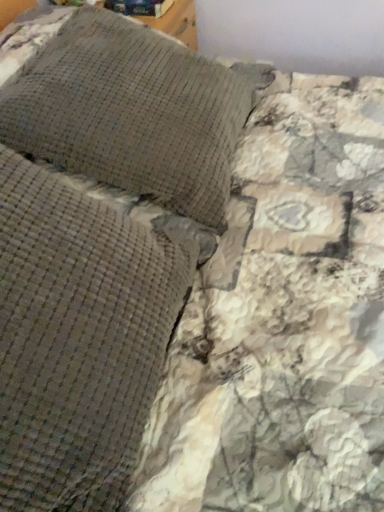
The height and width of the screenshot is (512, 384). What do you see at coordinates (78, 338) in the screenshot?
I see `woven fabric pillow at upper left, which ranks as the first pillow in front-to-back order` at bounding box center [78, 338].

Locate an element on the screen. This screenshot has width=384, height=512. woven fabric pillow at upper left, positioned as the 2th pillow in back-to-front order is located at coordinates (78, 338).

What are the coordinates of `woven fabric pillow at upper left, acting as the first pillow starting from the back` in the screenshot? It's located at (131, 113).

Image resolution: width=384 pixels, height=512 pixels. What do you see at coordinates (131, 113) in the screenshot? I see `woven fabric pillow at upper left, the second pillow when ordered from front to back` at bounding box center [131, 113].

You are a GUI agent. You are given a task and a screenshot of the screen. Output one action in this format:
    pyautogui.click(x=<x>, y=<y>)
    Task: Click on the woven fabric pillow at upper left, which ranks as the first pillow in front-to-back order
    
    Given the screenshot: What is the action you would take?
    pyautogui.click(x=78, y=338)

Is woven fabric pillow at upper left, positioned as the 2th pillow in back-to-front order, at the left side of woven fabric pillow at upper left, the second pillow when ordered from front to back?

Correct, you'll find woven fabric pillow at upper left, positioned as the 2th pillow in back-to-front order, to the left of woven fabric pillow at upper left, the second pillow when ordered from front to back.

Which object is further away from the camera, woven fabric pillow at upper left, positioned as the 2th pillow in back-to-front order, or woven fabric pillow at upper left, acting as the first pillow starting from the back?

Positioned behind is woven fabric pillow at upper left, acting as the first pillow starting from the back.

Which is in front, point (132, 403) or point (102, 120)?

The point (132, 403) is closer to the camera.

From the image's perspective, which is below, woven fabric pillow at upper left, positioned as the 2th pillow in back-to-front order, or woven fabric pillow at upper left, acting as the first pillow starting from the back?

woven fabric pillow at upper left, positioned as the 2th pillow in back-to-front order, from the image's perspective.

From a real-world perspective, does woven fabric pillow at upper left, positioned as the 2th pillow in back-to-front order, stand above woven fabric pillow at upper left, the second pillow when ordered from front to back?

Yes, from a real-world perspective, woven fabric pillow at upper left, positioned as the 2th pillow in back-to-front order, is above woven fabric pillow at upper left, the second pillow when ordered from front to back.

Based on the photo, which of these two, woven fabric pillow at upper left, which ranks as the first pillow in front-to-back order, or woven fabric pillow at upper left, acting as the first pillow starting from the back, is thinner?

woven fabric pillow at upper left, which ranks as the first pillow in front-to-back order.

From their relative heights in the image, would you say woven fabric pillow at upper left, positioned as the 2th pillow in back-to-front order, is taller or shorter than woven fabric pillow at upper left, the second pillow when ordered from front to back?

Considering their sizes, woven fabric pillow at upper left, positioned as the 2th pillow in back-to-front order, has less height than woven fabric pillow at upper left, the second pillow when ordered from front to back.

Does woven fabric pillow at upper left, which ranks as the first pillow in front-to-back order, have a larger size compared to woven fabric pillow at upper left, acting as the first pillow starting from the back?

No.

Would you say woven fabric pillow at upper left, positioned as the 2th pillow in back-to-front order, contains woven fabric pillow at upper left, the second pillow when ordered from front to back?

No, woven fabric pillow at upper left, positioned as the 2th pillow in back-to-front order, does not contain woven fabric pillow at upper left, the second pillow when ordered from front to back.

Is woven fabric pillow at upper left, which ranks as the first pillow in front-to-back order, not near woven fabric pillow at upper left, the second pillow when ordered from front to back?

No, woven fabric pillow at upper left, which ranks as the first pillow in front-to-back order, is in close proximity to woven fabric pillow at upper left, the second pillow when ordered from front to back.

Is woven fabric pillow at upper left, positioned as the 2th pillow in back-to-front order, turned away from woven fabric pillow at upper left, acting as the first pillow starting from the back?

No, woven fabric pillow at upper left, positioned as the 2th pillow in back-to-front order, is not facing the opposite direction of woven fabric pillow at upper left, acting as the first pillow starting from the back.

What's the angular difference between woven fabric pillow at upper left, positioned as the 2th pillow in back-to-front order, and woven fabric pillow at upper left, the second pillow when ordered from front to back,'s facing directions?

woven fabric pillow at upper left, positioned as the 2th pillow in back-to-front order, and woven fabric pillow at upper left, the second pillow when ordered from front to back, are facing 0.000717 degrees away from each other.

What are the coordinates of `pillow lying in front of the woven fabric pillow at upper left, the second pillow when ordered from front to back` in the screenshot? It's located at (78, 338).

Which object is positioned more to the right, woven fabric pillow at upper left, the second pillow when ordered from front to back, or woven fabric pillow at upper left, which ranks as the first pillow in front-to-back order?

woven fabric pillow at upper left, the second pillow when ordered from front to back, is more to the right.

Does woven fabric pillow at upper left, the second pillow when ordered from front to back, come in front of woven fabric pillow at upper left, positioned as the 2th pillow in back-to-front order?

No, it is not.

Which is nearer, (209, 175) or (40, 269)?

Clearly, point (209, 175) is more distant from the camera than point (40, 269).

From the image's perspective, which one is positioned higher, woven fabric pillow at upper left, the second pillow when ordered from front to back, or woven fabric pillow at upper left, which ranks as the first pillow in front-to-back order?

woven fabric pillow at upper left, the second pillow when ordered from front to back, appears higher in the image.

From a real-world perspective, does woven fabric pillow at upper left, the second pillow when ordered from front to back, sit lower than woven fabric pillow at upper left, which ranks as the first pillow in front-to-back order?

Yes.

Based on the photo, is woven fabric pillow at upper left, the second pillow when ordered from front to back, thinner than woven fabric pillow at upper left, positioned as the 2th pillow in back-to-front order?

No, woven fabric pillow at upper left, the second pillow when ordered from front to back, is not thinner than woven fabric pillow at upper left, positioned as the 2th pillow in back-to-front order.

Who is taller, woven fabric pillow at upper left, acting as the first pillow starting from the back, or woven fabric pillow at upper left, which ranks as the first pillow in front-to-back order?

With more height is woven fabric pillow at upper left, acting as the first pillow starting from the back.

Based on their sizes in the image, would you say woven fabric pillow at upper left, acting as the first pillow starting from the back, is bigger or smaller than woven fabric pillow at upper left, which ranks as the first pillow in front-to-back order?

Considering their sizes, woven fabric pillow at upper left, acting as the first pillow starting from the back, takes up more space than woven fabric pillow at upper left, which ranks as the first pillow in front-to-back order.

Is woven fabric pillow at upper left, the second pillow when ordered from front to back, not within woven fabric pillow at upper left, which ranks as the first pillow in front-to-back order?

Yes, woven fabric pillow at upper left, the second pillow when ordered from front to back, is outside of woven fabric pillow at upper left, which ranks as the first pillow in front-to-back order.

From the picture: Is woven fabric pillow at upper left, the second pillow when ordered from front to back, beside woven fabric pillow at upper left, which ranks as the first pillow in front-to-back order?

There is a gap between woven fabric pillow at upper left, the second pillow when ordered from front to back, and woven fabric pillow at upper left, which ranks as the first pillow in front-to-back order.

Is woven fabric pillow at upper left, which ranks as the first pillow in front-to-back order, at the back of woven fabric pillow at upper left, acting as the first pillow starting from the back?

That's not correct — woven fabric pillow at upper left, acting as the first pillow starting from the back, is not looking away from woven fabric pillow at upper left, which ranks as the first pillow in front-to-back order.

What's the angular difference between woven fabric pillow at upper left, acting as the first pillow starting from the back, and woven fabric pillow at upper left, positioned as the 2th pillow in back-to-front order,'s facing directions?

The facing directions of woven fabric pillow at upper left, acting as the first pillow starting from the back, and woven fabric pillow at upper left, positioned as the 2th pillow in back-to-front order, are 0.000717 degrees apart.

Measure the distance from woven fabric pillow at upper left, the second pillow when ordered from front to back, to woven fabric pillow at upper left, which ranks as the first pillow in front-to-back order.

11.99 inches.

The width and height of the screenshot is (384, 512). What are the coordinates of `pillow below the woven fabric pillow at upper left, positioned as the 2th pillow in back-to-front order (from a real-world perspective)` in the screenshot? It's located at (131, 113).

You are a GUI agent. You are given a task and a screenshot of the screen. Output one action in this format:
    pyautogui.click(x=<x>, y=<y>)
    Task: Click on the pillow behind the woven fabric pillow at upper left, positioned as the 2th pillow in back-to-front order
    Image resolution: width=384 pixels, height=512 pixels.
    Given the screenshot: What is the action you would take?
    pyautogui.click(x=131, y=113)

Find the location of a particular element. pillow above the woven fabric pillow at upper left, which ranks as the first pillow in front-to-back order (from the image's perspective) is located at coordinates (131, 113).